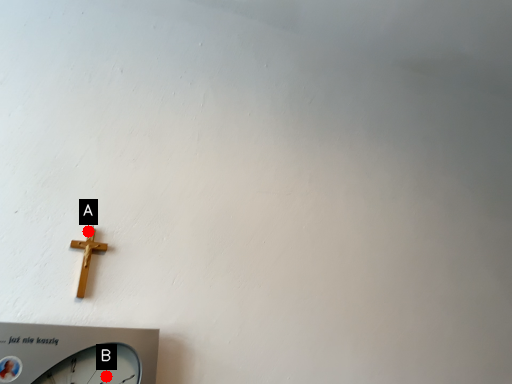
Question: Two points are circled on the image, labeled by A and B beside each circle. Which point appears farthest from the camera in this image?

Choices:
 (A) A is further
 (B) B is further

Answer: (A)